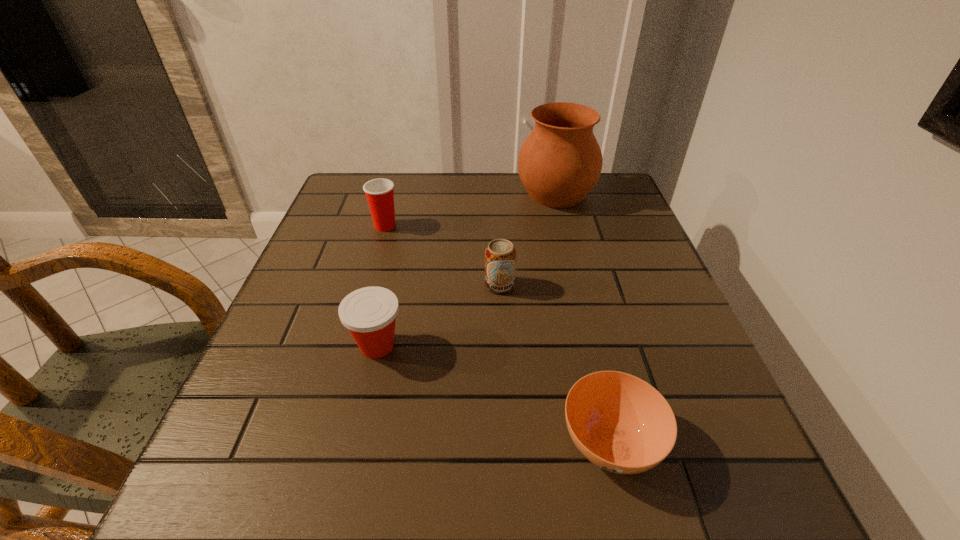
Identify the location of the tallest object. (559, 163).

At what (x,y) coordinates should I click in order to perform the action: click on the farthest object. Please return your answer as a coordinate pair (x, y). Looking at the image, I should click on (559, 163).

Where is `the farther Dixie cup`? the farther Dixie cup is located at coordinates (379, 192).

At what (x,y) coordinates should I click in order to perform the action: click on beer can. Please return your answer as a coordinate pair (x, y). The image size is (960, 540). Looking at the image, I should click on (500, 256).

I want to click on the third nearest object, so click(x=500, y=256).

The width and height of the screenshot is (960, 540). Find the location of `the nearer Dixie cup`. the nearer Dixie cup is located at coordinates (369, 313).

You are a GUI agent. You are given a task and a screenshot of the screen. Output one action in this format:
    pyautogui.click(x=<x>, y=<y>)
    Task: Click on the shortest object
    
    Given the screenshot: What is the action you would take?
    pyautogui.click(x=622, y=424)

In order to click on the nearest object in this screenshot , I will do `click(622, 424)`.

At what (x,y) coordinates should I click in order to perform the action: click on free space located on the left of the farthest object. Please return your answer as a coordinate pair (x, y). This screenshot has height=540, width=960. Looking at the image, I should click on (385, 194).

Find the location of a particular element. This screenshot has width=960, height=540. blank area located 0.300m on the front of the second farthest object is located at coordinates (358, 322).